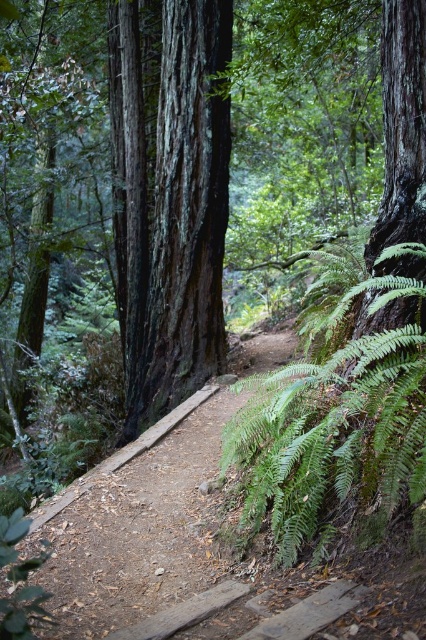
Can you confirm if green leafy fern at right is taller than dirt path at center?

Yes, green leafy fern at right is taller than dirt path at center.

Is point (241, 426) positioned after point (55, 534)?

Yes, it is.

Find the location of a particular element. The width and height of the screenshot is (426, 640). green leafy fern at right is located at coordinates (333, 435).

Can you confirm if dark brown textured bark at center is positioned to the right of green leafy fern at right?

No, dark brown textured bark at center is not to the right of green leafy fern at right.

In the scene shown: Which is more to the left, dark brown textured bark at center or green leafy fern at right?

From the viewer's perspective, dark brown textured bark at center appears more on the left side.

This screenshot has height=640, width=426. I want to click on dark brown textured bark at center, so click(x=172, y=204).

Does dark brown textured bark at center have a lesser width compared to dirt path at center?

Incorrect, dark brown textured bark at center's width is not less than dirt path at center's.

Between dark brown textured bark at center and dirt path at center, which one appears on the left side from the viewer's perspective?

From the viewer's perspective, dark brown textured bark at center appears more on the left side.

Is point (169, 388) positioned after point (123, 563)?

Yes, point (169, 388) is farther from viewer.

At what (x,y) coordinates should I click in order to perform the action: click on dark brown textured bark at center. Please return your answer as a coordinate pair (x, y). Looking at the image, I should click on [x=172, y=204].